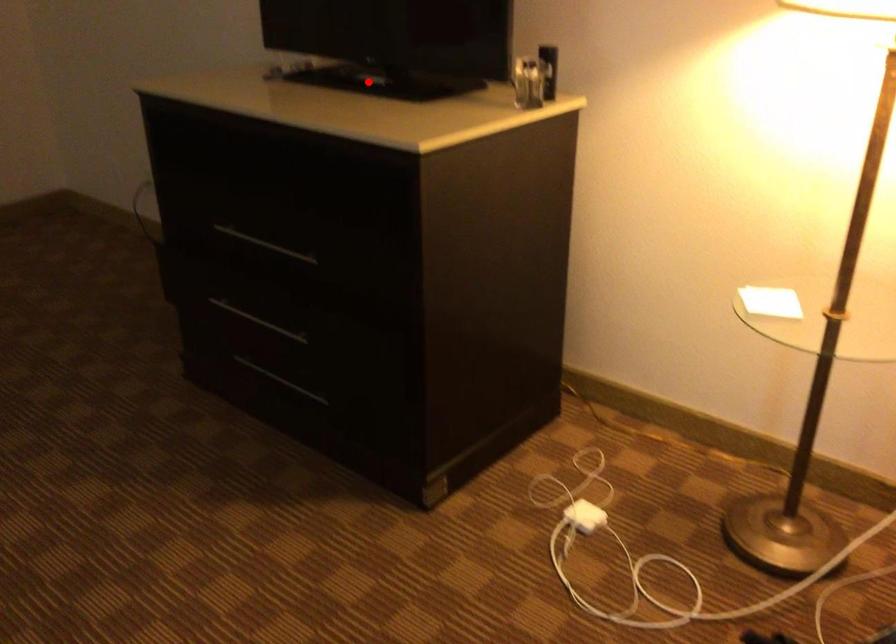
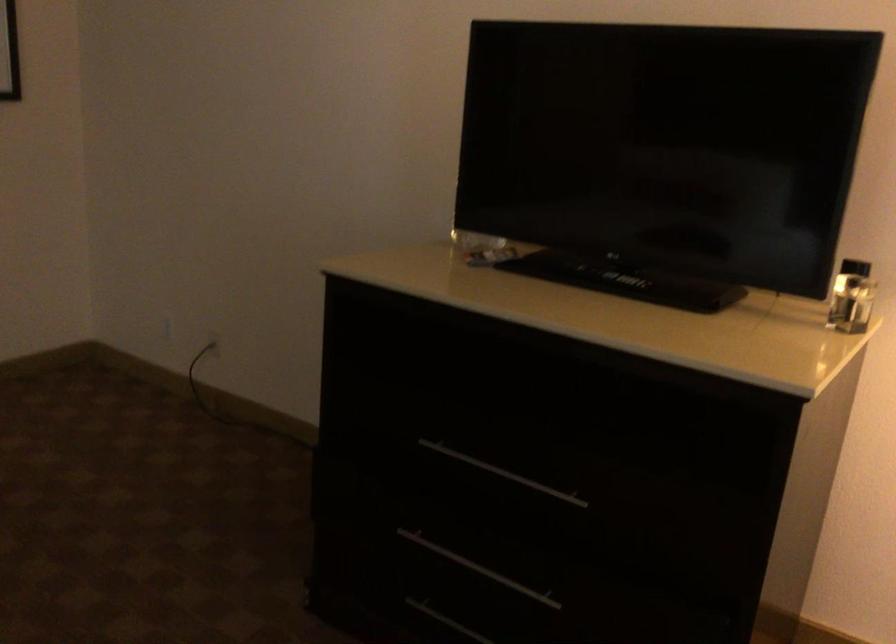
Question: I am providing you with two images of the same scene from different viewpoints. A red point is shown in image1. For the corresponding object point in image2, is it positioned nearer or farther from the camera?

Choices:
 (A) Nearer
 (B) Farther

Answer: (A)